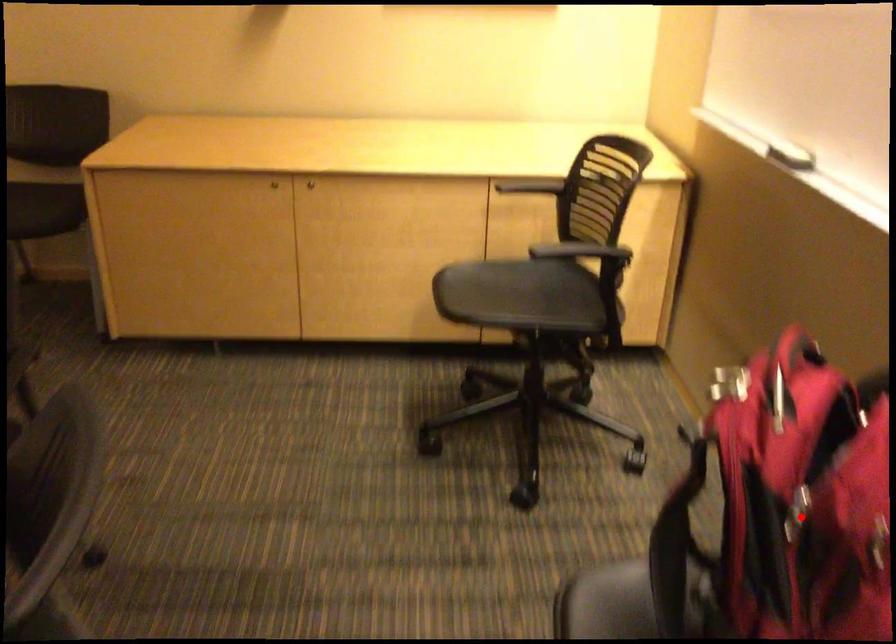
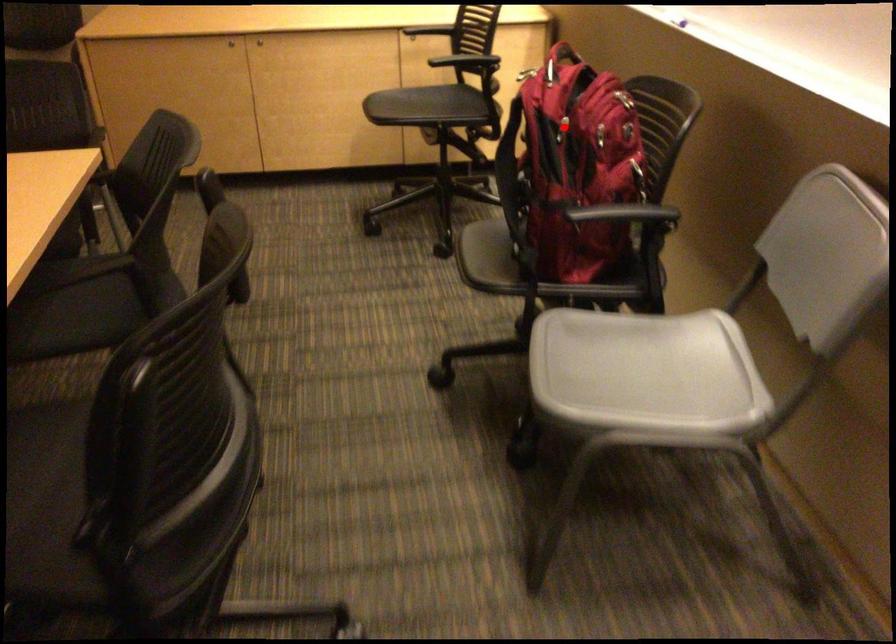
I am providing you with two images of the same scene from different viewpoints. A red point is marked on the first image and another point is marked on the second image. Are the points marked in image1 and image2 representing the same 3D position?

Yes